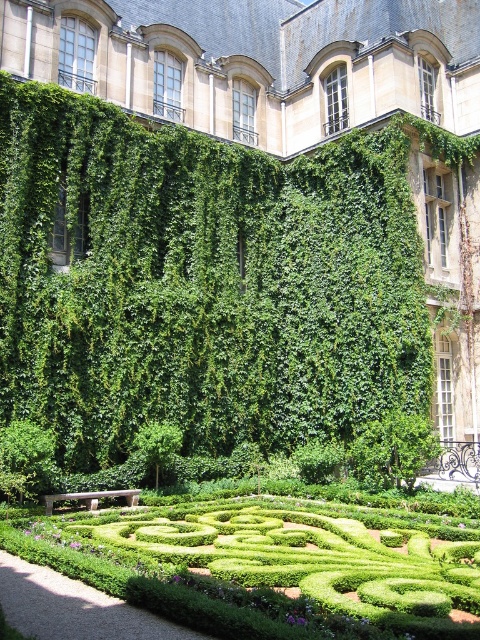
Is green hedge maze at center smaller than green leafy bush at center?

Actually, green hedge maze at center might be larger than green leafy bush at center.

Is point (338, 525) farther from camera compared to point (407, 426)?

No, (338, 525) is closer to viewer.

Where is `green hedge maze at center`? green hedge maze at center is located at coordinates (269, 566).